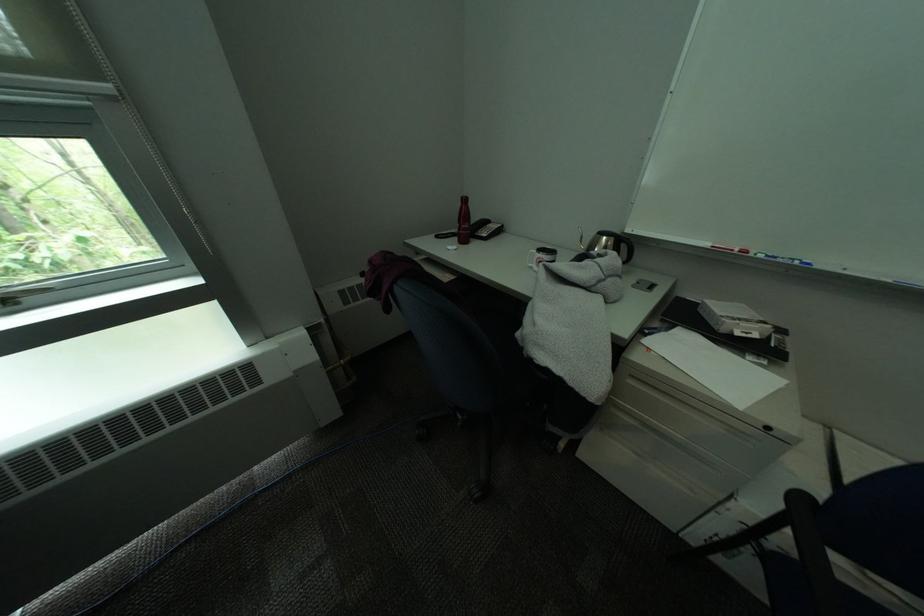
Where is `window latch`? The height and width of the screenshot is (616, 924). window latch is located at coordinates (7, 305).